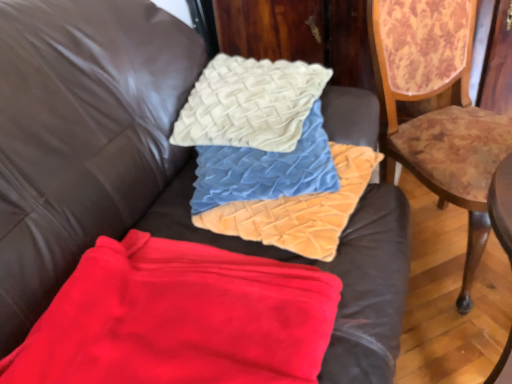
Image resolution: width=512 pixels, height=384 pixels. What do you see at coordinates (438, 109) in the screenshot? I see `wooden floral-patterned chair at right` at bounding box center [438, 109].

Where is `velvet textured pillows at center, the second material positioned from the bottom`? velvet textured pillows at center, the second material positioned from the bottom is located at coordinates (300, 210).

In the image, is velvet textured pillows at center, the second material positioned from the bottom, positioned in front of or behind velvet textured pillow at center?

velvet textured pillows at center, the second material positioned from the bottom, is positioned closer to the viewer than velvet textured pillow at center.

Is velvet textured pillows at center, the second material positioned from the bottom, oriented towards velvet textured pillow at center?

Yes, velvet textured pillows at center, the second material positioned from the bottom, is turned towards velvet textured pillow at center.

Is point (368, 164) farther from viewer compared to point (224, 152)?

No, it is not.

Looking at this image, which object is positioned more to the right, velvet textured pillows at center, which is the 1th material in top-to-bottom order, or velvet textured pillow at center?

From the viewer's perspective, velvet textured pillows at center, which is the 1th material in top-to-bottom order, appears more on the right side.

Is point (383, 53) more distant than point (251, 218)?

Yes, it is behind point (251, 218).

Between wooden floral-patterned chair at right and velvet textured pillows at center, the second material positioned from the bottom, which one appears on the left side from the viewer's perspective?

From the viewer's perspective, velvet textured pillows at center, the second material positioned from the bottom, appears more on the left side.

Consider the image. Does wooden floral-patterned chair at right lie behind velvet textured pillows at center, the second material positioned from the bottom?

No, the depth of wooden floral-patterned chair at right is less than that of velvet textured pillows at center, the second material positioned from the bottom.

Can you confirm if wooden floral-patterned chair at right is bigger than velvet textured pillows at center, which is the 1th material in top-to-bottom order?

Correct, wooden floral-patterned chair at right is larger in size than velvet textured pillows at center, which is the 1th material in top-to-bottom order.

Which of these two, velvet textured pillow at center or wooden floral-patterned chair at right, is bigger?

wooden floral-patterned chair at right is bigger.

In the image, is velvet textured pillow at center on the left side or the right side of wooden floral-patterned chair at right?

In the image, velvet textured pillow at center appears on the left side of wooden floral-patterned chair at right.

From a real-world perspective, is velvet textured pillow at center positioned above or below wooden floral-patterned chair at right?

From a real-world perspective, velvet textured pillow at center is physically above wooden floral-patterned chair at right.

Do you think velvet textured pillow at center is within wooden floral-patterned chair at right, or outside of it?

velvet textured pillow at center is not enclosed by wooden floral-patterned chair at right.

From the image's perspective, between red fleece blanket at lower left, the second material when ordered from top to bottom, and wooden floral-patterned chair at right, which one is located above?

wooden floral-patterned chair at right.

Is red fleece blanket at lower left, which appears as the 1th material when ordered from the bottom, far from wooden floral-patterned chair at right?

They are positioned close to each other.

From a real-world perspective, does red fleece blanket at lower left, which appears as the 1th material when ordered from the bottom, sit lower than wooden floral-patterned chair at right?

No.

Which object is positioned more to the right, red fleece blanket at lower left, which appears as the 1th material when ordered from the bottom, or wooden floral-patterned chair at right?

wooden floral-patterned chair at right.

Is red fleece blanket at lower left, which appears as the 1th material when ordered from the bottom, in front of or behind velvet textured pillow at center in the image?

In the image, red fleece blanket at lower left, which appears as the 1th material when ordered from the bottom, appears in front of velvet textured pillow at center.

Considering the sizes of red fleece blanket at lower left, which appears as the 1th material when ordered from the bottom, and velvet textured pillow at center in the image, is red fleece blanket at lower left, which appears as the 1th material when ordered from the bottom, wider or thinner than velvet textured pillow at center?

red fleece blanket at lower left, which appears as the 1th material when ordered from the bottom, is wider than velvet textured pillow at center.

Is red fleece blanket at lower left, the second material when ordered from top to bottom, taller than velvet textured pillow at center?

In fact, red fleece blanket at lower left, the second material when ordered from top to bottom, may be shorter than velvet textured pillow at center.

Does red fleece blanket at lower left, the second material when ordered from top to bottom, contain velvet textured pillow at center?

Definitely not — velvet textured pillow at center is not inside red fleece blanket at lower left, the second material when ordered from top to bottom.

Can you confirm if velvet textured pillow at center is shorter than velvet textured pillows at center, the second material positioned from the bottom?

No, velvet textured pillow at center is not shorter than velvet textured pillows at center, the second material positioned from the bottom.

In terms of width, does velvet textured pillow at center look wider or thinner when compared to velvet textured pillows at center, which is the 1th material in top-to-bottom order?

Considering their sizes, velvet textured pillow at center looks slimmer than velvet textured pillows at center, which is the 1th material in top-to-bottom order.

Could you measure the distance between velvet textured pillow at center and velvet textured pillows at center, the second material positioned from the bottom?

2.55 inches.

Is velvet textured pillow at center positioned before velvet textured pillows at center, the second material positioned from the bottom?

No.

Between velvet textured pillows at center, the second material positioned from the bottom, and red fleece blanket at lower left, the second material when ordered from top to bottom, which one is positioned behind?

Positioned behind is velvet textured pillows at center, the second material positioned from the bottom.

From a real-world perspective, is velvet textured pillows at center, the second material positioned from the bottom, on top of red fleece blanket at lower left, the second material when ordered from top to bottom?

Indeed, from a real-world perspective, velvet textured pillows at center, the second material positioned from the bottom, stands above red fleece blanket at lower left, the second material when ordered from top to bottom.

Looking at their sizes, would you say velvet textured pillows at center, the second material positioned from the bottom, is wider or thinner than red fleece blanket at lower left, the second material when ordered from top to bottom?

Considering their sizes, velvet textured pillows at center, the second material positioned from the bottom, looks slimmer than red fleece blanket at lower left, the second material when ordered from top to bottom.

The image size is (512, 384). Find the location of `the 1st material in front of the velvet textured pillow at center`. the 1st material in front of the velvet textured pillow at center is located at coordinates (300, 210).

The image size is (512, 384). What are the coordinates of `the 1st material below the wooden floral-patterned chair at right (from the image's perspective)` in the screenshot? It's located at [300, 210].

Estimate the real-world distances between objects in this image. Which object is further from velvet textured pillow at center, velvet textured pillows at center, which is the 1th material in top-to-bottom order, or wooden floral-patterned chair at right?

Based on the image, wooden floral-patterned chair at right appears to be further to velvet textured pillow at center.

Estimate the real-world distances between objects in this image. Which object is further from creamy velvet cushion at upper center, wooden floral-patterned chair at right or red fleece blanket at lower left, which appears as the 1th material when ordered from the bottom?

Among the two, red fleece blanket at lower left, which appears as the 1th material when ordered from the bottom, is located further to creamy velvet cushion at upper center.

Estimate the real-world distances between objects in this image. Which object is closer to velvet textured pillow at center, velvet textured pillows at center, which is the 1th material in top-to-bottom order, or red fleece blanket at lower left, which appears as the 1th material when ordered from the bottom?

velvet textured pillows at center, which is the 1th material in top-to-bottom order, is positioned closer to the anchor velvet textured pillow at center.

From the image, which object appears to be nearer to velvet textured pillows at center, which is the 1th material in top-to-bottom order, wooden floral-patterned chair at right or velvet textured pillow at center?

Based on the image, velvet textured pillow at center appears to be nearer to velvet textured pillows at center, which is the 1th material in top-to-bottom order.

When comparing their distances from red fleece blanket at lower left, the second material when ordered from top to bottom, does velvet textured pillow at center or wooden floral-patterned chair at right seem closer?

velvet textured pillow at center.

Considering their positions, is wooden floral-patterned chair at right positioned closer to creamy velvet cushion at upper center than velvet textured pillows at center, which is the 1th material in top-to-bottom order?

A: velvet textured pillows at center, which is the 1th material in top-to-bottom order, is closer to creamy velvet cushion at upper center.

Estimate the real-world distances between objects in this image. Which object is closer to creamy velvet cushion at upper center, red fleece blanket at lower left, which appears as the 1th material when ordered from the bottom, or velvet textured pillows at center, the second material positioned from the bottom?

Among the two, velvet textured pillows at center, the second material positioned from the bottom, is located nearer to creamy velvet cushion at upper center.

Estimate the real-world distances between objects in this image. Which object is further from creamy velvet cushion at upper center, red fleece blanket at lower left, the second material when ordered from top to bottom, or velvet textured pillow at center?

The object further to creamy velvet cushion at upper center is red fleece blanket at lower left, the second material when ordered from top to bottom.

You are a GUI agent. You are given a task and a screenshot of the screen. Output one action in this format:
    pyautogui.click(x=<x>, y=<y>)
    Task: Click on the pillow situated between creamy velvet cushion at upper center and wooden floral-patterned chair at right from left to right
    Image resolution: width=512 pixels, height=384 pixels.
    Given the screenshot: What is the action you would take?
    pyautogui.click(x=265, y=169)

Where is `pillow between creamy velvet cushion at upper center and velvet textured pillows at center, the second material positioned from the bottom, vertically`? pillow between creamy velvet cushion at upper center and velvet textured pillows at center, the second material positioned from the bottom, vertically is located at coordinates (265, 169).

The height and width of the screenshot is (384, 512). Identify the location of material located between creamy velvet cushion at upper center and wooden floral-patterned chair at right in the left-right direction. (300, 210).

The height and width of the screenshot is (384, 512). In order to click on pillow between red fleece blanket at lower left, which appears as the 1th material when ordered from the bottom, and wooden floral-patterned chair at right, in the horizontal direction in this screenshot , I will do click(265, 169).